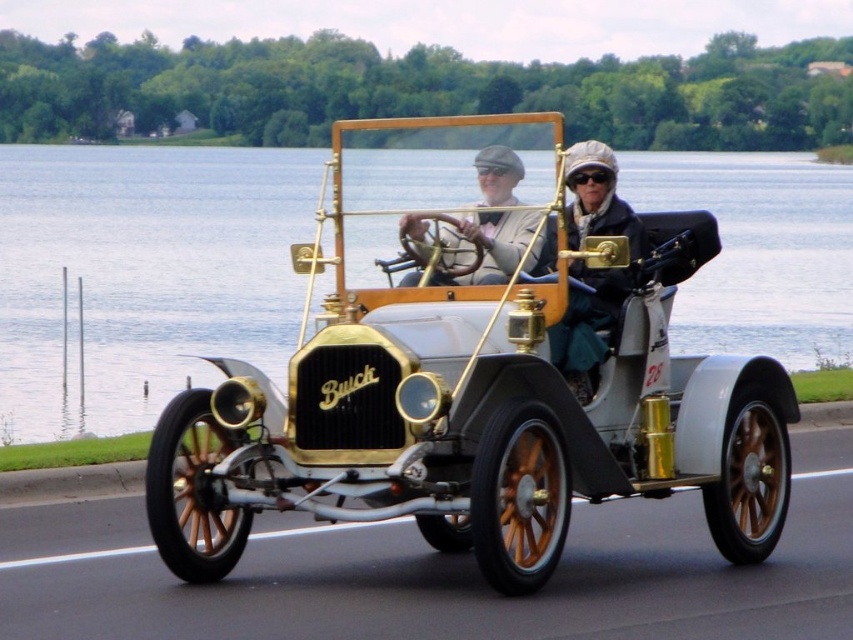
Is white polished wood car at center wider than matte black jacket at center?

Correct, the width of white polished wood car at center exceeds that of matte black jacket at center.

Which is more to the left, white polished wood car at center or matte black jacket at center?

From the viewer's perspective, white polished wood car at center appears more on the left side.

Is point (187, 529) closer to viewer compared to point (582, 292)?

Yes, it is in front of point (582, 292).

Identify the location of white polished wood car at center. tap(485, 394).

Can you confirm if white polished wood car at center is positioned below matte gold steering wheel at center?

Correct, white polished wood car at center is located below matte gold steering wheel at center.

This screenshot has height=640, width=853. What are the coordinates of `white polished wood car at center` in the screenshot? It's located at (485, 394).

Is point (578, 394) closer to camera compared to point (483, 172)?

Yes, point (578, 394) is closer to viewer.

What are the coordinates of `matte black jacket at center` in the screenshot? It's located at (587, 324).

The image size is (853, 640). What do you see at coordinates (587, 324) in the screenshot?
I see `matte black jacket at center` at bounding box center [587, 324].

Locate an element on the screen. The image size is (853, 640). matte black jacket at center is located at coordinates (587, 324).